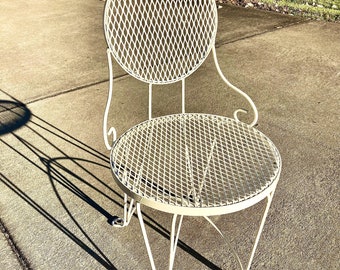
Image resolution: width=340 pixels, height=270 pixels. Identify the location of seat of white metal chair. click(x=188, y=140).